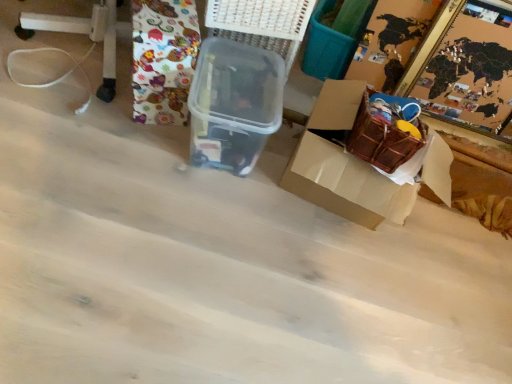
In order to click on wooden puzzle frame at upper right in this screenshot , I will do `click(466, 67)`.

This screenshot has width=512, height=384. What do you see at coordinates (261, 17) in the screenshot?
I see `white plastic basket at upper center` at bounding box center [261, 17].

This screenshot has width=512, height=384. I want to click on wooden puzzle frame at upper right, so click(x=466, y=67).

Relative to brown cardboard box at lower right, is transparent plastic container at center in front or behind?

Visually, transparent plastic container at center is located behind brown cardboard box at lower right.

Is point (246, 115) behind point (320, 117)?

No.

Is transparent plastic container at center oriented away from brown cardboard box at lower right?

No.

Measure the distance between transparent plastic container at center and brown cardboard box at lower right.

A distance of 10.04 inches exists between transparent plastic container at center and brown cardboard box at lower right.

Based on the photo, which is more to the left, brown cardboard box at lower right or transparent plastic container at center?

transparent plastic container at center is more to the left.

Does brown cardboard box at lower right have a larger size compared to transparent plastic container at center?

Indeed, brown cardboard box at lower right has a larger size compared to transparent plastic container at center.

Is brown cardboard box at lower right spatially inside transparent plastic container at center, or outside of it?

brown cardboard box at lower right is not enclosed by transparent plastic container at center.

Could you tell me if brown cardboard box at lower right is facing transparent plastic container at center?

No, brown cardboard box at lower right is not facing towards transparent plastic container at center.

Are transparent plastic container at center and white plastic basket at upper center making contact?

transparent plastic container at center is not next to white plastic basket at upper center, and they're not touching.

Between transparent plastic container at center and white plastic basket at upper center, which one has less height?

white plastic basket at upper center.

Can we say transparent plastic container at center lies outside white plastic basket at upper center?

Yes, transparent plastic container at center is not within white plastic basket at upper center.

Does transparent plastic container at center have a smaller size compared to white plastic basket at upper center?

Actually, transparent plastic container at center might be larger than white plastic basket at upper center.

Does wooden puzzle frame at upper right turn towards patterned fabric at upper left?

No, wooden puzzle frame at upper right does not turn towards patterned fabric at upper left.

Identify the location of wrapping paper located above the wooden puzzle frame at upper right (from a real-world perspective). Image resolution: width=512 pixels, height=384 pixels. (163, 59).

Between wooden puzzle frame at upper right and patterned fabric at upper left, which one has larger width?

wooden puzzle frame at upper right.

Which object is further away from the camera, wooden puzzle frame at upper right or patterned fabric at upper left?

wooden puzzle frame at upper right is more distant.

You are a GUI agent. You are given a task and a screenshot of the screen. Output one action in this format:
    pyautogui.click(x=<x>, y=<y>)
    Task: Click on the wrapping paper lying below the white plastic basket at upper center (from the image's perspective)
    
    Given the screenshot: What is the action you would take?
    pyautogui.click(x=163, y=59)

Between patterned fabric at upper left and white plastic basket at upper center, which one has larger size?

patterned fabric at upper left is bigger.

From a real-world perspective, relative to white plastic basket at upper center, is patterned fabric at upper left vertically above or below?

Clearly, from a real-world perspective, patterned fabric at upper left is below white plastic basket at upper center.

Which object is positioned more to the right, patterned fabric at upper left or transparent plastic container at center?

transparent plastic container at center is more to the right.

Can transparent plastic container at center be found inside patterned fabric at upper left?

No, transparent plastic container at center is not a part of patterned fabric at upper left.

From the image's perspective, is patterned fabric at upper left under transparent plastic container at center?

No, from the image's perspective, patterned fabric at upper left is not below transparent plastic container at center.

Does patterned fabric at upper left come in front of transparent plastic container at center?

Yes, it is.

Considering their positions, is white plastic basket at upper center located in front of or behind transparent plastic container at center?

white plastic basket at upper center is behind transparent plastic container at center.

Which point is more forward, (248, 20) or (259, 147)?

The point (259, 147) is closer to the camera.

Based on their positions, is white plastic basket at upper center located to the left or right of transparent plastic container at center?

Clearly, white plastic basket at upper center is on the right of transparent plastic container at center in the image.

Is white plastic basket at upper center beside transparent plastic container at center?

There is a gap between white plastic basket at upper center and transparent plastic container at center.

Where is `storage box above the brown cardboard box at lower right (from the image's perspective)`? The height and width of the screenshot is (384, 512). storage box above the brown cardboard box at lower right (from the image's perspective) is located at coordinates (234, 104).

This screenshot has height=384, width=512. In order to click on storage box lying behind the brown cardboard box at lower right in this screenshot , I will do `click(234, 104)`.

When comparing their distances from white plastic basket at upper center, does wooden puzzle frame at upper right or patterned fabric at upper left seem further?

wooden puzzle frame at upper right lies further to white plastic basket at upper center than the other object.

Estimate the real-world distances between objects in this image. Which object is closer to transparent plastic container at center, brown cardboard box at lower right or patterned fabric at upper left?

The object closer to transparent plastic container at center is patterned fabric at upper left.

Based on their spatial positions, is brown cardboard box at lower right or white plastic basket at upper center closer to wooden puzzle frame at upper right?

brown cardboard box at lower right lies closer to wooden puzzle frame at upper right than the other object.

From the image, which object appears to be farther from transparent plastic container at center, white plastic basket at upper center or patterned fabric at upper left?

white plastic basket at upper center lies further to transparent plastic container at center than the other object.

When comparing their distances from transparent plastic container at center, does patterned fabric at upper left or wooden puzzle frame at upper right seem closer?

Among the two, patterned fabric at upper left is located nearer to transparent plastic container at center.

Looking at the image, which one is located closer to white plastic basket at upper center, transparent plastic container at center or wooden puzzle frame at upper right?

The object closer to white plastic basket at upper center is transparent plastic container at center.

Considering their positions, is patterned fabric at upper left positioned closer to brown cardboard box at lower right than transparent plastic container at center?

Among the two, transparent plastic container at center is located nearer to brown cardboard box at lower right.

From the image, which object appears to be farther from white plastic basket at upper center, patterned fabric at upper left or transparent plastic container at center?

patterned fabric at upper left.

The image size is (512, 384). What are the coordinates of `basket between transparent plastic container at center and wooden puzzle frame at upper right in the horizontal direction` in the screenshot? It's located at (261, 17).

At what (x,y) coordinates should I click in order to perform the action: click on basket situated between patterned fabric at upper left and brown cardboard box at lower right from left to right. Please return your answer as a coordinate pair (x, y). The image size is (512, 384). Looking at the image, I should click on (261, 17).

Where is `storage box that lies between white plastic basket at upper center and brown cardboard box at lower right from top to bottom`? storage box that lies between white plastic basket at upper center and brown cardboard box at lower right from top to bottom is located at coordinates (234, 104).

The image size is (512, 384). What are the coordinates of `storage box situated between patterned fabric at upper left and wooden puzzle frame at upper right from left to right` in the screenshot? It's located at (234, 104).